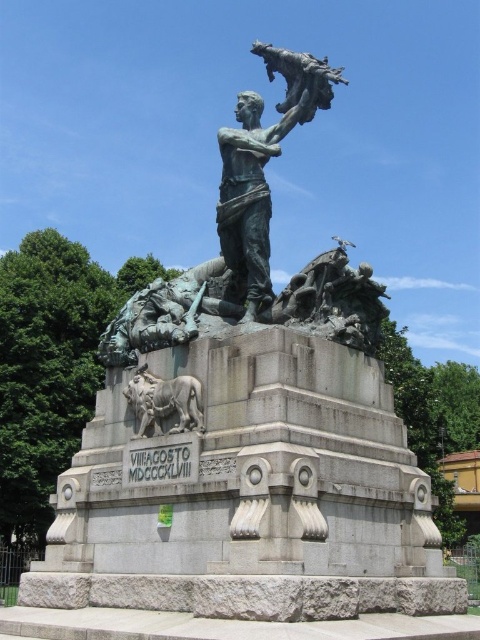
Question: Does bronze statue at center have a lesser width compared to sculpted stone lion at lower left?

Choices:
 (A) no
 (B) yes

Answer: (A)

Question: Which object appears closest to the camera in this image?

Choices:
 (A) sculpted stone lion at lower left
 (B) bronze statue at center

Answer: (A)

Question: Which object is closer to the camera taking this photo?

Choices:
 (A) sculpted stone lion at lower left
 (B) bronze statue at center

Answer: (A)

Question: Which of the following is the farthest from the observer?

Choices:
 (A) (140, 388)
 (B) (224, 164)

Answer: (B)

Question: Is bronze statue at center wider than sculpted stone lion at lower left?

Choices:
 (A) no
 (B) yes

Answer: (B)

Question: Does bronze statue at center appear under sculpted stone lion at lower left?

Choices:
 (A) no
 (B) yes

Answer: (A)